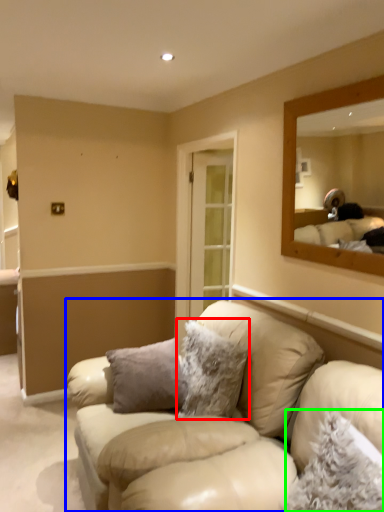
Question: Based on their relative distances, which object is farther from pillow (highlighted by a red box)? Choose from studio couch (highlighted by a blue box) and pillow (highlighted by a green box).

Choices:
 (A) studio couch
 (B) pillow

Answer: (B)